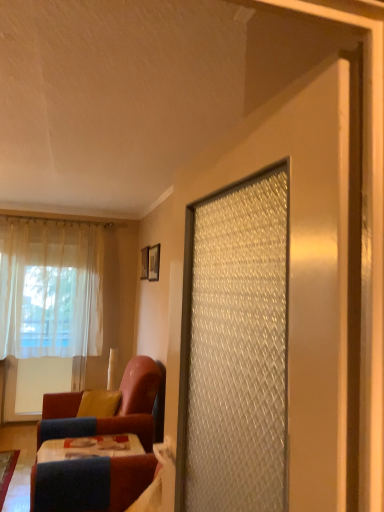
Locate an element on the screen. yellow fabric pillow at lower left is located at coordinates (99, 403).

This screenshot has height=512, width=384. What do you see at coordinates (118, 410) in the screenshot?
I see `velvet-like red chair at lower left` at bounding box center [118, 410].

Locate an element on the screen. The image size is (384, 512). wooden picture frame at upper center, which is the first picture frame from left to right is located at coordinates (144, 263).

Considering the sizes of objects velvet-like red chair at lower left and white sheer curtain at left in the image provided, who is shorter, velvet-like red chair at lower left or white sheer curtain at left?

With less height is velvet-like red chair at lower left.

Considering the sizes of velvet-like red chair at lower left and white sheer curtain at left in the image, is velvet-like red chair at lower left bigger or smaller than white sheer curtain at left?

Considering their sizes, velvet-like red chair at lower left takes up more space than white sheer curtain at left.

Is the surface of velvet-like red chair at lower left in direct contact with white sheer curtain at left?

No, velvet-like red chair at lower left is not in contact with white sheer curtain at left.

In the image, there is a white sheer curtain at left. Identify the location of chair below it (from the image's perspective). (118, 410).

Would you say matte black picture frame at upper center, positioned as the second picture frame in back-to-front order, is part of white sheer curtain at left's contents?

No, white sheer curtain at left does not contain matte black picture frame at upper center, positioned as the second picture frame in back-to-front order.

From the image's perspective, which is above, white sheer curtain at left or matte black picture frame at upper center, placed as the 1th picture frame when sorted from front to back?

matte black picture frame at upper center, placed as the 1th picture frame when sorted from front to back, from the image's perspective.

Looking at this image, how many degrees apart are the facing directions of white sheer curtain at left and matte black picture frame at upper center, placed as the 1th picture frame when sorted from front to back?

The angle between the facing direction of white sheer curtain at left and the facing direction of matte black picture frame at upper center, placed as the 1th picture frame when sorted from front to back, is 90.2 degrees.

In the scene shown: Is white sheer curtain at left in front of matte black picture frame at upper center, acting as the first picture frame starting from the right?

No, it is not.

Which is in front, wooden table at lower left or yellow fabric pillow at lower left?

wooden table at lower left is more forward.

Looking at this image, from the image's perspective, which one is positioned lower, wooden table at lower left or yellow fabric pillow at lower left?

From the image's view, wooden table at lower left is below.

Is wooden table at lower left facing towards yellow fabric pillow at lower left?

No, wooden table at lower left is not aimed at yellow fabric pillow at lower left.

From a real-world perspective, who is located higher, yellow fabric pillow at lower left or velvet-like red chair at lower left?

yellow fabric pillow at lower left is physically above.

Is velvet-like red chair at lower left at the back of yellow fabric pillow at lower left?

Yes, yellow fabric pillow at lower left's orientation is away from velvet-like red chair at lower left.

Is yellow fabric pillow at lower left positioned far away from velvet-like red chair at lower left?

Actually, yellow fabric pillow at lower left and velvet-like red chair at lower left are a little close together.

Would you say velvet-like red chair at lower left is part of yellow fabric pillow at lower left's contents?

No, velvet-like red chair at lower left is not a part of yellow fabric pillow at lower left.

Does wooden picture frame at upper center, which is the first picture frame from left to right, lie in front of yellow fabric pillow at lower left?

No, it is not.

Does wooden picture frame at upper center, which is the first picture frame from left to right, have a lesser height compared to yellow fabric pillow at lower left?

In fact, wooden picture frame at upper center, which is the first picture frame from left to right, may be taller than yellow fabric pillow at lower left.

Could you tell me if wooden picture frame at upper center, acting as the second picture frame starting from the front, is facing yellow fabric pillow at lower left?

No, wooden picture frame at upper center, acting as the second picture frame starting from the front, is not oriented towards yellow fabric pillow at lower left.

Is wooden picture frame at upper center, which is counted as the second picture frame, starting from the right, far from yellow fabric pillow at lower left?

Yes, wooden picture frame at upper center, which is counted as the second picture frame, starting from the right, and yellow fabric pillow at lower left are quite far apart.

Is white sheer curtain at left positioned beyond the bounds of velvet-like red chair at lower left?

Yes, white sheer curtain at left is located beyond the bounds of velvet-like red chair at lower left.

I want to click on curtain that appears above the velvet-like red chair at lower left (from a real-world perspective), so click(x=50, y=288).

Considering the relative positions of white sheer curtain at left and velvet-like red chair at lower left in the image provided, is white sheer curtain at left in front of velvet-like red chair at lower left?

That is False.

How different are the orientations of matte black picture frame at upper center, placed as the 1th picture frame when sorted from front to back, and wooden table at lower left in degrees?

They differ by 0.0191 degrees in their facing directions.

Is matte black picture frame at upper center, acting as the first picture frame starting from the right, completely or partially outside of wooden table at lower left?

Yes, matte black picture frame at upper center, acting as the first picture frame starting from the right, is outside of wooden table at lower left.

From the image's perspective, who appears lower, matte black picture frame at upper center, acting as the first picture frame starting from the right, or wooden table at lower left?

wooden table at lower left is shown below in the image.

In the scene shown: Does matte black picture frame at upper center, placed as the 1th picture frame when sorted from front to back, have a greater height compared to wooden table at lower left?

No, matte black picture frame at upper center, placed as the 1th picture frame when sorted from front to back, is not taller than wooden table at lower left.

Locate an element on the screen. chair located underneath the white sheer curtain at left (from a real-world perspective) is located at coordinates (118, 410).

Identify the location of picture frame that is the 1st object located above the white sheer curtain at left (from the image's perspective). This screenshot has width=384, height=512. (154, 262).

Considering their positions, is velvet-like red chair at lower left positioned further to matte black picture frame at upper center, the second picture frame viewed from the left, than wooden table at lower left?

wooden table at lower left lies further to matte black picture frame at upper center, the second picture frame viewed from the left, than the other object.

Based on the photo, when comparing their distances from white sheer curtain at left, does yellow fabric pillow at lower left or matte black picture frame at upper center, positioned as the second picture frame in back-to-front order, seem further?

yellow fabric pillow at lower left lies further to white sheer curtain at left than the other object.

Based on their spatial positions, is matte black picture frame at upper center, positioned as the second picture frame in back-to-front order, or wooden table at lower left closer to velvet-like red chair at lower left?

Among the two, wooden table at lower left is located nearer to velvet-like red chair at lower left.

Based on their spatial positions, is yellow fabric pillow at lower left or wooden table at lower left further from matte black picture frame at upper center, acting as the first picture frame starting from the right?

The object further to matte black picture frame at upper center, acting as the first picture frame starting from the right, is wooden table at lower left.

Estimate the real-world distances between objects in this image. Which object is further from wooden picture frame at upper center, which is counted as the second picture frame, starting from the right, velvet-like red chair at lower left or yellow fabric pillow at lower left?

Based on the image, velvet-like red chair at lower left appears to be further to wooden picture frame at upper center, which is counted as the second picture frame, starting from the right.

Based on their spatial positions, is white sheer curtain at left or velvet-like red chair at lower left closer to wooden table at lower left?

velvet-like red chair at lower left is closer to wooden table at lower left.

Looking at the image, which one is located closer to wooden table at lower left, yellow fabric pillow at lower left or wooden picture frame at upper center, which is counted as the second picture frame, starting from the right?

yellow fabric pillow at lower left lies closer to wooden table at lower left than the other object.

Considering their positions, is matte black picture frame at upper center, positioned as the second picture frame in back-to-front order, positioned further to yellow fabric pillow at lower left than velvet-like red chair at lower left?

matte black picture frame at upper center, positioned as the second picture frame in back-to-front order, lies further to yellow fabric pillow at lower left than the other object.

Where is `chair between wooden table at lower left and matte black picture frame at upper center, acting as the first picture frame starting from the right, along the z-axis`? chair between wooden table at lower left and matte black picture frame at upper center, acting as the first picture frame starting from the right, along the z-axis is located at coordinates (118, 410).

You are a GUI agent. You are given a task and a screenshot of the screen. Output one action in this format:
    pyautogui.click(x=<x>, y=<y>)
    Task: Click on the picture frame located between wooden table at lower left and wooden picture frame at upper center, acting as the second picture frame starting from the front, in the depth direction
    The width and height of the screenshot is (384, 512).
    Given the screenshot: What is the action you would take?
    pyautogui.click(x=154, y=262)

The width and height of the screenshot is (384, 512). Identify the location of chair between wooden table at lower left and white sheer curtain at left in the front-back direction. (118, 410).

You are a GUI agent. You are given a task and a screenshot of the screen. Output one action in this format:
    pyautogui.click(x=<x>, y=<y>)
    Task: Click on the curtain between wooden table at lower left and wooden picture frame at upper center, which is the first picture frame from left to right, from front to back
    This screenshot has height=512, width=384.
    Given the screenshot: What is the action you would take?
    pyautogui.click(x=50, y=288)